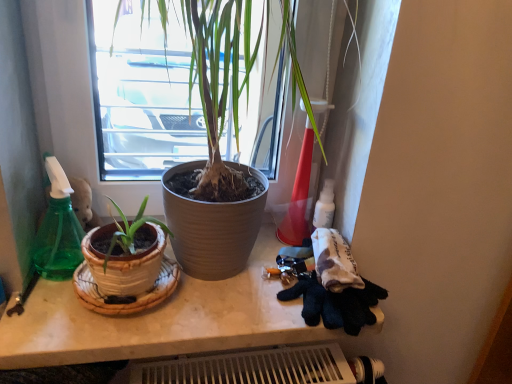
Question: In the image, is white marble counter at center positioned in front of or behind green plastic spray bottle at left?

Choices:
 (A) behind
 (B) front

Answer: (B)

Question: Considering the positions of white marble counter at center and green plastic spray bottle at left in the image, is white marble counter at center bigger or smaller than green plastic spray bottle at left?

Choices:
 (A) small
 (B) big

Answer: (B)

Question: Considering the positions of white marble counter at center and green plastic spray bottle at left in the image, is white marble counter at center taller or shorter than green plastic spray bottle at left?

Choices:
 (A) short
 (B) tall

Answer: (A)

Question: From a real-world perspective, is green plastic spray bottle at left above or below white marble counter at center?

Choices:
 (A) above
 (B) below

Answer: (A)

Question: In terms of size, does green plastic spray bottle at left appear bigger or smaller than white marble counter at center?

Choices:
 (A) small
 (B) big

Answer: (A)

Question: From the image's perspective, is green plastic spray bottle at left positioned above or below white marble counter at center?

Choices:
 (A) above
 (B) below

Answer: (A)

Question: Is green plastic spray bottle at left to the left or to the right of white marble counter at center in the image?

Choices:
 (A) left
 (B) right

Answer: (A)